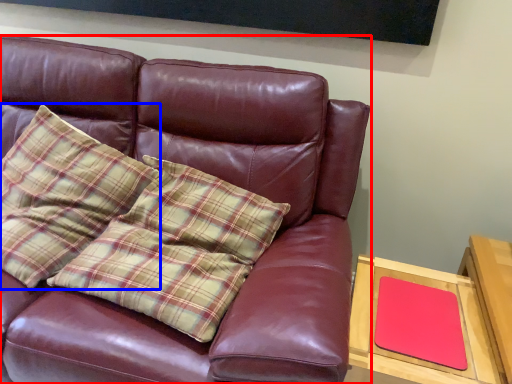
Question: Which point is closer to the camera, studio couch (highlighted by a red box) or pillow (highlighted by a blue box)?

Choices:
 (A) studio couch
 (B) pillow

Answer: (A)